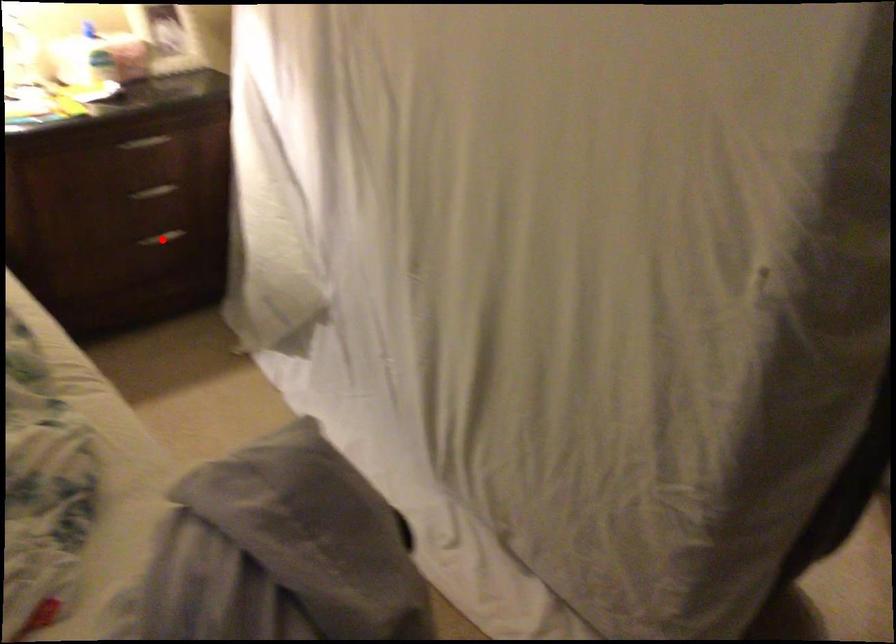
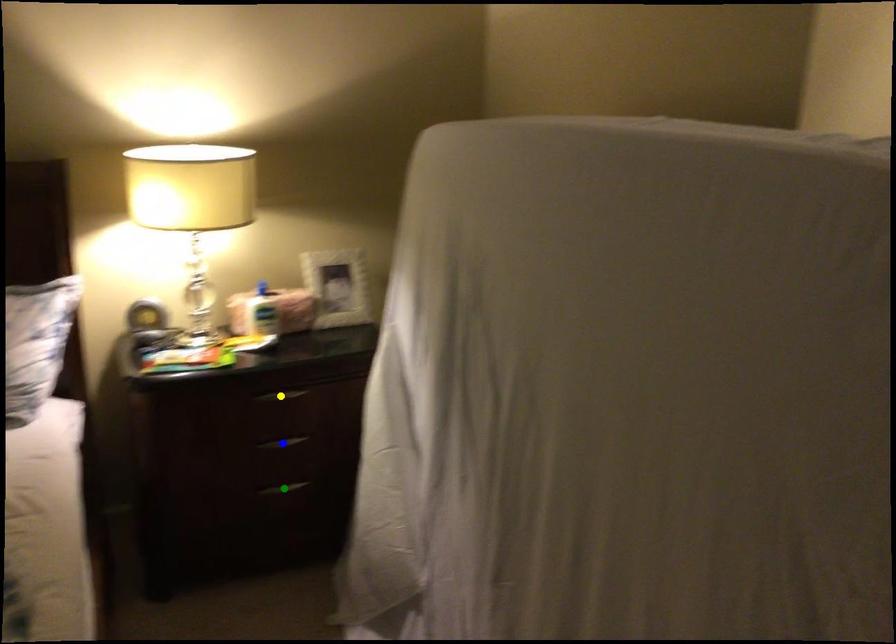
Question: I am providing you with two images of the same scene from different viewpoints. A red point is marked on the first image. You are given multiple points on the second image. Which point in image 2 is actually the same real-world point as the red point in image 1?

Choices:
 (A) green point
 (B) yellow point
 (C) blue point

Answer: (A)